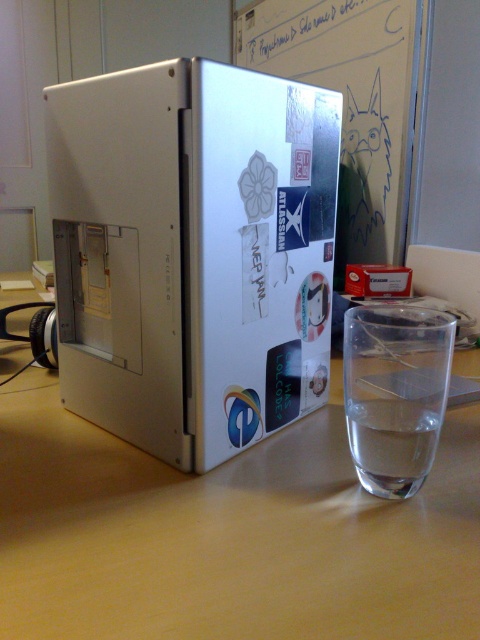
Between matte plastic computer case at center and transparent glass at right, which one has more height?

Standing taller between the two is transparent glass at right.

The image size is (480, 640). I want to click on matte plastic computer case at center, so click(228, 532).

Identify the location of matte plastic computer case at center. The width and height of the screenshot is (480, 640). (228, 532).

Is satin silver laptop at center to the left of transparent glass at right from the viewer's perspective?

Indeed, satin silver laptop at center is positioned on the left side of transparent glass at right.

Does satin silver laptop at center come behind transparent glass at right?

Yes, satin silver laptop at center is further from the viewer.

You are a GUI agent. You are given a task and a screenshot of the screen. Output one action in this format:
    pyautogui.click(x=<x>, y=<y>)
    Task: Click on the satin silver laptop at center
    This screenshot has width=480, height=640.
    Given the screenshot: What is the action you would take?
    pyautogui.click(x=192, y=253)

From the picture: Can you confirm if satin silver laptop at center is shorter than matte plastic computer case at center?

In fact, satin silver laptop at center may be taller than matte plastic computer case at center.

At what (x,y) coordinates should I click in order to perform the action: click on satin silver laptop at center. Please return your answer as a coordinate pair (x, y). Looking at the image, I should click on (192, 253).

You are a GUI agent. You are given a task and a screenshot of the screen. Output one action in this format:
    pyautogui.click(x=<x>, y=<y>)
    Task: Click on the satin silver laptop at center
    This screenshot has height=640, width=480.
    Given the screenshot: What is the action you would take?
    pyautogui.click(x=192, y=253)